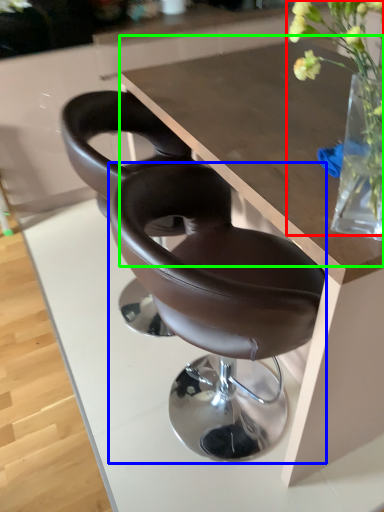
Question: Which object is positioned closest to floral arrangement (highlighted by a red box)? Select from chair (highlighted by a blue box) and round table (highlighted by a green box).

Choices:
 (A) chair
 (B) round table

Answer: (A)